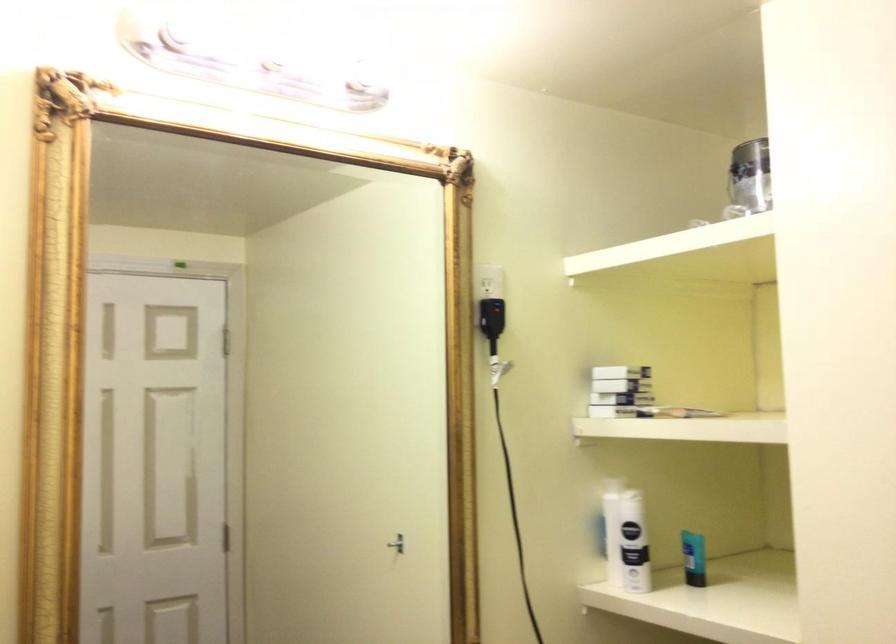
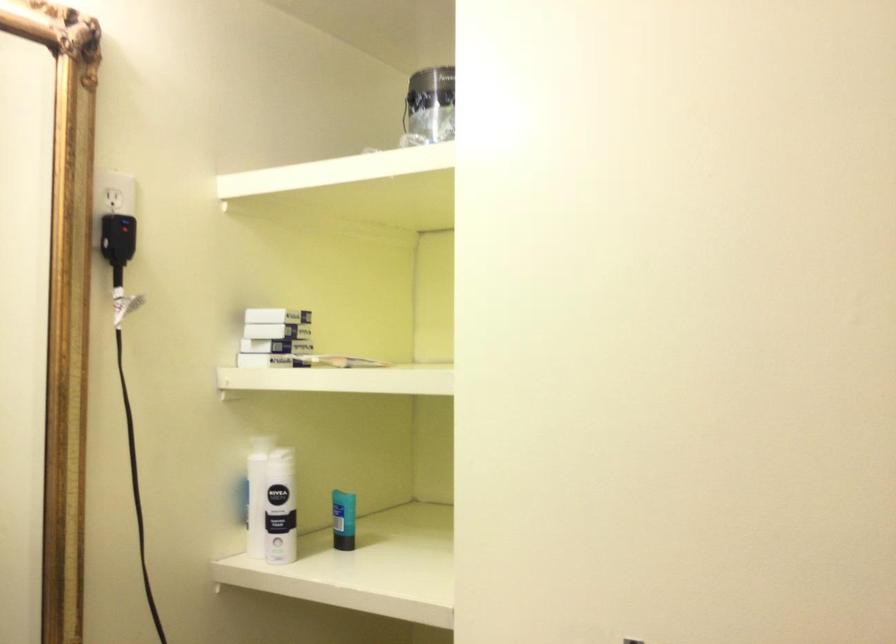
In the second image, find the point that corresponds to (x=633, y=538) in the first image.

(271, 504)